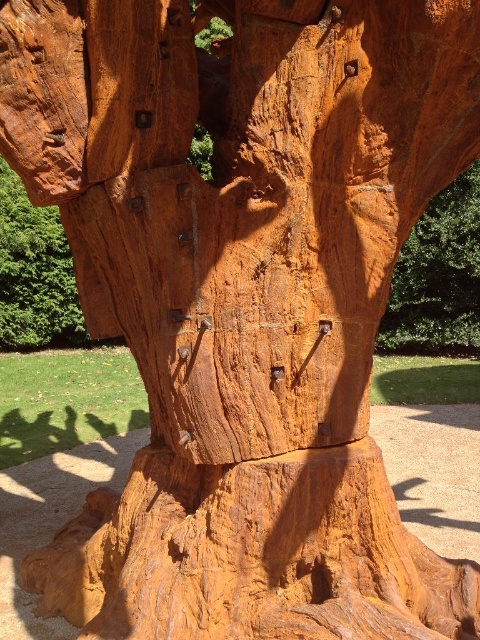
Question: Can you confirm if smooth orange wood at upper right is positioned to the right of rustic wood carving at upper left?

Choices:
 (A) yes
 (B) no

Answer: (A)

Question: Does smooth orange wood at upper right have a larger size compared to rustic wood carving at upper left?

Choices:
 (A) no
 (B) yes

Answer: (B)

Question: Can you confirm if smooth orange wood at upper right is positioned below rustic wood carving at upper left?

Choices:
 (A) no
 (B) yes

Answer: (B)

Question: Which object is farther from the camera taking this photo?

Choices:
 (A) smooth orange wood at upper right
 (B) rustic wood carving at upper left

Answer: (B)

Question: Which point is farther to the camera?

Choices:
 (A) (388, 305)
 (B) (86, 336)

Answer: (B)